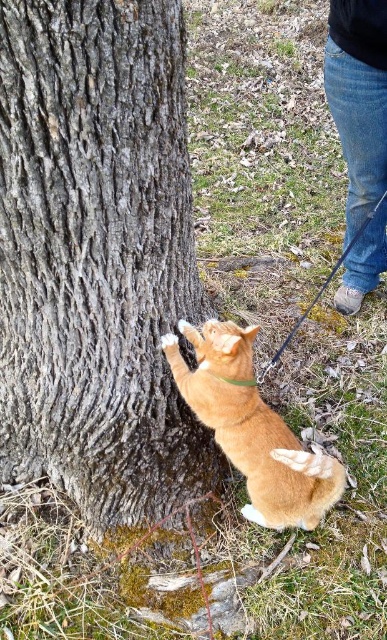
Is orange fur cat at center thinner than jeans at lower right?

Incorrect, orange fur cat at center's width is not less than jeans at lower right's.

Between point (203, 336) and point (371, 109), which one is positioned behind?

The point (371, 109) is more distant.

You are a GUI agent. You are given a task and a screenshot of the screen. Output one action in this format:
    pyautogui.click(x=<x>, y=<y>)
    Task: Click on the orange fur cat at center
    The width and height of the screenshot is (387, 640).
    Given the screenshot: What is the action you would take?
    pyautogui.click(x=253, y=428)

What are the coordinates of `orange fur cat at center` in the screenshot? It's located at (253, 428).

Is point (183, 29) more distant than point (265, 440)?

That is False.

Is gray rough bark tree trunk at center thinner than orange fur cat at center?

Incorrect, gray rough bark tree trunk at center's width is not less than orange fur cat at center's.

Who is more forward, (111, 60) or (316, 472)?

Point (111, 60) is in front.

Locate an element on the screen. gray rough bark tree trunk at center is located at coordinates (97, 257).

Is gray rough bark tree trunk at center wider than jeans at lower right?

Yes.

From the picture: Is gray rough bark tree trunk at center taller than jeans at lower right?

Indeed, gray rough bark tree trunk at center has a greater height compared to jeans at lower right.

Is point (193, 436) closer to viewer compared to point (366, 113)?

Yes, point (193, 436) is closer to viewer.

Where is `gray rough bark tree trunk at center`? Image resolution: width=387 pixels, height=640 pixels. gray rough bark tree trunk at center is located at coordinates (97, 257).